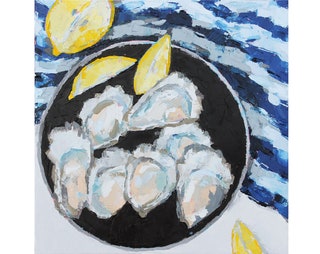
The height and width of the screenshot is (254, 320). I want to click on painting, so click(x=39, y=214).